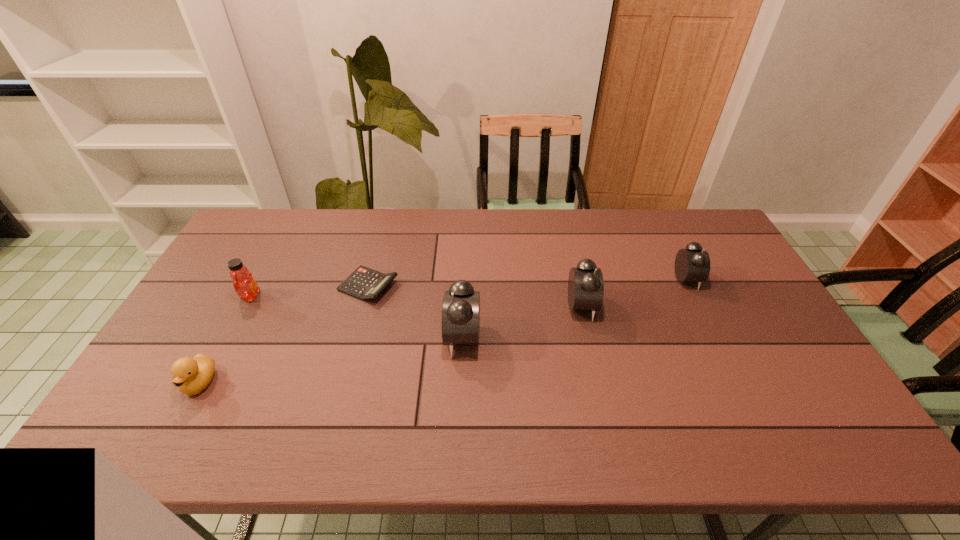
Where is `free space located on the front side of the leftmost alarm clock`? free space located on the front side of the leftmost alarm clock is located at coordinates (388, 336).

At what (x,y) coordinates should I click in order to perform the action: click on vacant space situated on the front side of the leftmost alarm clock. Please return your answer as a coordinate pair (x, y). This screenshot has width=960, height=540. Looking at the image, I should click on (363, 336).

At what (x,y) coordinates should I click in order to perform the action: click on vacant space positioned 0.340m on the front side of the leftmost alarm clock. Please return your answer as a coordinate pair (x, y). The image size is (960, 540). Looking at the image, I should click on (323, 336).

Where is `blank space located 0.130m on the front side of the second tallest alarm clock`? This screenshot has width=960, height=540. blank space located 0.130m on the front side of the second tallest alarm clock is located at coordinates (639, 306).

This screenshot has height=540, width=960. What are the coordinates of `free space located on the front side of the shortest alarm clock` in the screenshot? It's located at (729, 279).

I want to click on vacant space located 0.360m on the front label of the honey, so click(379, 296).

Where is `blank area located on the left of the third object from left to right`? This screenshot has width=960, height=540. blank area located on the left of the third object from left to right is located at coordinates (265, 286).

What are the coordinates of `object present at the near edge` in the screenshot? It's located at (191, 375).

Locate an element on the screen. honey that is at the left edge is located at coordinates (244, 284).

At what (x,y) coordinates should I click in order to perform the action: click on duckling located in the left edge section of the desktop. Please return your answer as a coordinate pair (x, y). The width and height of the screenshot is (960, 540). Looking at the image, I should click on (191, 375).